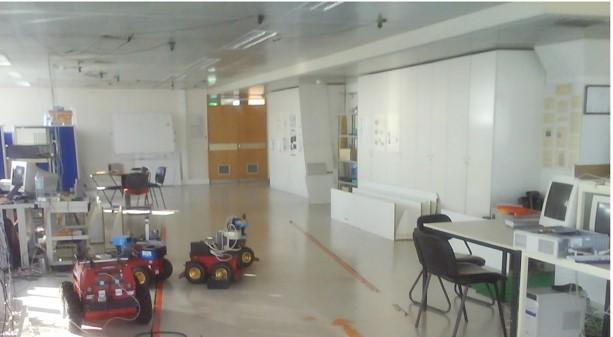
Where is `computer tower`? computer tower is located at coordinates (552, 306).